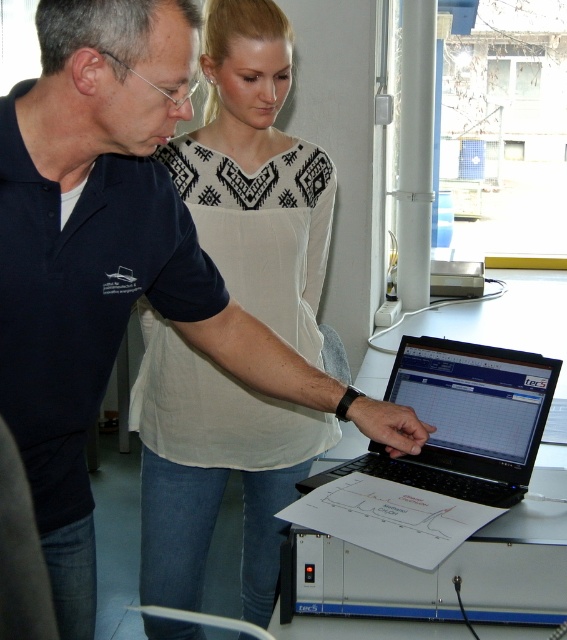
Who is higher up, white fabric apron at center or black glossy laptop at center?

white fabric apron at center

Does white fabric apron at center appear on the left side of black glossy laptop at center?

Correct, you'll find white fabric apron at center to the left of black glossy laptop at center.

Is point (273, 244) more distant than point (532, 372)?

Yes.

Where is `white fabric apron at center`? Image resolution: width=567 pixels, height=640 pixels. white fabric apron at center is located at coordinates (214, 410).

Does white printed blouse at upper center have a lesser height compared to black plastic laptop at center?

Incorrect, white printed blouse at upper center's height does not fall short of black plastic laptop at center's.

Is white printed blouse at upper center wider than black plastic laptop at center?

No.

Is point (290, 177) less distant than point (333, 632)?

No, (290, 177) is behind (333, 632).

You are a GUI agent. You are given a task and a screenshot of the screen. Output one action in this format:
    pyautogui.click(x=<x>, y=<y>)
    Task: Click on the white printed blouse at upper center
    The width and height of the screenshot is (567, 640).
    Given the screenshot: What is the action you would take?
    pyautogui.click(x=256, y=173)

In the scene shown: Is black glossy laptop at center above black plastic laptop at center?

Incorrect, black glossy laptop at center is not positioned above black plastic laptop at center.

Is point (521, 406) farther from viewer compared to point (388, 364)?

No, (521, 406) is in front of (388, 364).

What are the coordinates of `black glossy laptop at center` in the screenshot? It's located at (463, 420).

The image size is (567, 640). Find the location of `black glossy laptop at center`. black glossy laptop at center is located at coordinates (463, 420).